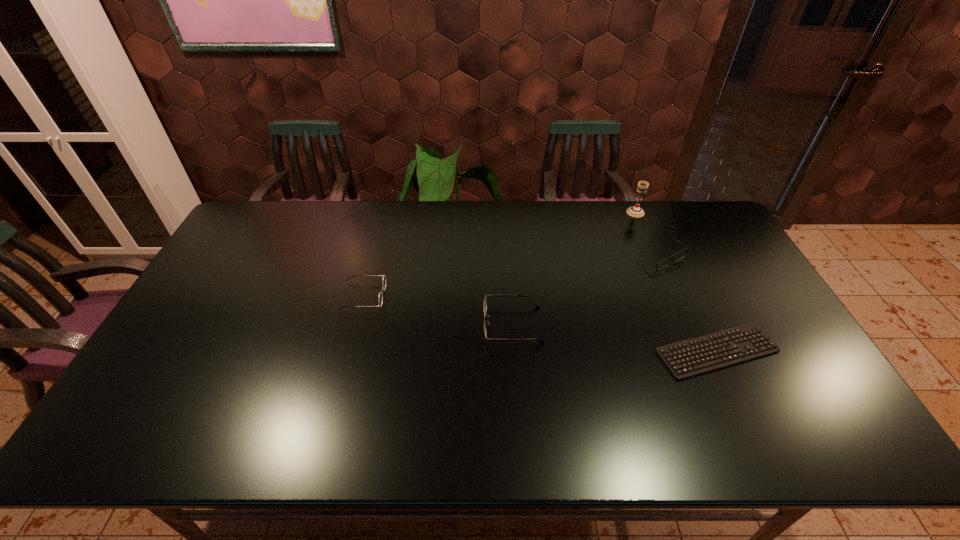
Locate an element on the screen. This screenshot has width=960, height=540. free location at the right edge of the desktop is located at coordinates (755, 282).

This screenshot has height=540, width=960. In the image, there is a desktop. Find the location of `vacant space at the far left corner`. vacant space at the far left corner is located at coordinates (284, 217).

This screenshot has width=960, height=540. Identify the location of vacant space at the near left corner of the desktop. 164,419.

You are a GUI agent. You are given a task and a screenshot of the screen. Output one action in this format:
    pyautogui.click(x=<x>, y=<y>)
    Task: Click on the vacant area between the leftmost object and the chalice
    
    Given the screenshot: What is the action you would take?
    pyautogui.click(x=499, y=254)

Where is `vacant point located between the leftmost spectacles and the computer keyboard`? vacant point located between the leftmost spectacles and the computer keyboard is located at coordinates (540, 323).

The height and width of the screenshot is (540, 960). Identify the location of free spot between the fourth object from right to left and the chalice. (574, 268).

This screenshot has height=540, width=960. Find the location of `free point between the fourth tallest object and the computer keyboard`. free point between the fourth tallest object and the computer keyboard is located at coordinates (615, 338).

Where is `free spot between the second object from left to right and the tallest object`? This screenshot has height=540, width=960. free spot between the second object from left to right and the tallest object is located at coordinates pos(574,268).

The image size is (960, 540). What are the coordinates of `vacant area that lies between the shortest object and the second object from left to right` in the screenshot? It's located at (615, 338).

Image resolution: width=960 pixels, height=540 pixels. Find the location of `free spot between the rightmost spectacles and the shortest object`. free spot between the rightmost spectacles and the shortest object is located at coordinates (689, 304).